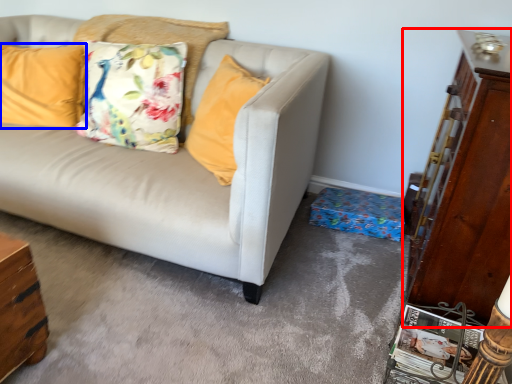
Question: Which point is further to the camera, dresser (highlighted by a red box) or pillow (highlighted by a blue box)?

Choices:
 (A) dresser
 (B) pillow

Answer: (B)